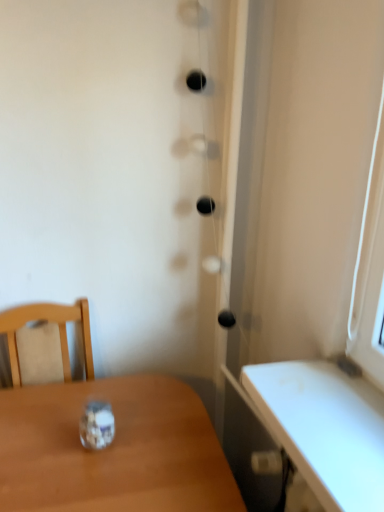
In order to face wooden table at lower left, should I rotate leftwards or rightwards?

To align with it, rotate left about 11.568°.

The width and height of the screenshot is (384, 512). Describe the element at coordinates (112, 450) in the screenshot. I see `wooden table at lower left` at that location.

At what (x,y) coordinates should I click in order to perform the action: click on wooden table at lower left. Please return your answer as a coordinate pair (x, y). The width and height of the screenshot is (384, 512). Looking at the image, I should click on (112, 450).

Where is `clear glass jar at center`? clear glass jar at center is located at coordinates (97, 425).

The image size is (384, 512). What do you see at coordinates (97, 425) in the screenshot? I see `clear glass jar at center` at bounding box center [97, 425].

What are the coordinates of `wooden table at lower left` in the screenshot? It's located at (112, 450).

Can you confirm if wooden table at lower left is positioned to the right of clear glass jar at center?

Yes, wooden table at lower left is to the right of clear glass jar at center.

Considering the relative positions of wooden table at lower left and clear glass jar at center in the image provided, is wooden table at lower left behind clear glass jar at center?

No, wooden table at lower left is closer to the camera.

Does point (46, 435) lie behind point (98, 417)?

Yes, point (46, 435) is farther from viewer.

From the image's perspective, would you say wooden table at lower left is shown under clear glass jar at center?

Correct, wooden table at lower left appears lower than clear glass jar at center in the image.

From a real-world perspective, is wooden table at lower left positioned above or below clear glass jar at center?

Clearly, from a real-world perspective, wooden table at lower left is below clear glass jar at center.

Looking at their sizes, would you say wooden table at lower left is wider or thinner than clear glass jar at center?

In the image, wooden table at lower left appears to be wider than clear glass jar at center.

Who is shorter, wooden table at lower left or clear glass jar at center?

clear glass jar at center.

In terms of size, does wooden table at lower left appear bigger or smaller than clear glass jar at center?

Considering their sizes, wooden table at lower left takes up more space than clear glass jar at center.

Do you think wooden table at lower left is within clear glass jar at center, or outside of it?

The correct answer is: outside.

Is wooden table at lower left far from clear glass jar at center?

No, wooden table at lower left is not far from clear glass jar at center.

Could you tell me if wooden table at lower left is turned towards clear glass jar at center?

No, wooden table at lower left is not turned towards clear glass jar at center.

This screenshot has width=384, height=512. Find the location of `glass jar behind the wooden table at lower left`. glass jar behind the wooden table at lower left is located at coordinates (97, 425).

Is clear glass jar at center to the right of wooden table at lower left from the viewer's perspective?

In fact, clear glass jar at center is to the left of wooden table at lower left.

Does clear glass jar at center come behind wooden table at lower left?

Yes, it is.

Which is in front, point (109, 433) or point (217, 501)?

The point (217, 501) is closer.

From the image's perspective, does clear glass jar at center appear higher than wooden table at lower left?

Correct, clear glass jar at center appears higher than wooden table at lower left in the image.

From a real-world perspective, is clear glass jar at center beneath wooden table at lower left?

No.

Looking at their sizes, would you say clear glass jar at center is wider or thinner than wooden table at lower left?

Clearly, clear glass jar at center has less width compared to wooden table at lower left.

Does clear glass jar at center have a greater height compared to wooden table at lower left?

Incorrect, the height of clear glass jar at center is not larger of that of wooden table at lower left.

Between clear glass jar at center and wooden table at lower left, which one has larger size?

With larger size is wooden table at lower left.

Is clear glass jar at center located outside wooden table at lower left?

Yes, clear glass jar at center is outside of wooden table at lower left.

Is clear glass jar at center beside wooden table at lower left?

clear glass jar at center and wooden table at lower left are clearly separated.

Is clear glass jar at center facing away from wooden table at lower left?

clear glass jar at center does not have its back to wooden table at lower left.

Find the location of `glass jar that is on the left side of wooden table at lower left`. glass jar that is on the left side of wooden table at lower left is located at coordinates click(97, 425).

Find the location of a particular element. The height and width of the screenshot is (512, 384). table beneath the clear glass jar at center (from a real-world perspective) is located at coordinates (112, 450).

Identify the location of glass jar that appears on the left of wooden table at lower left. The width and height of the screenshot is (384, 512). (97, 425).